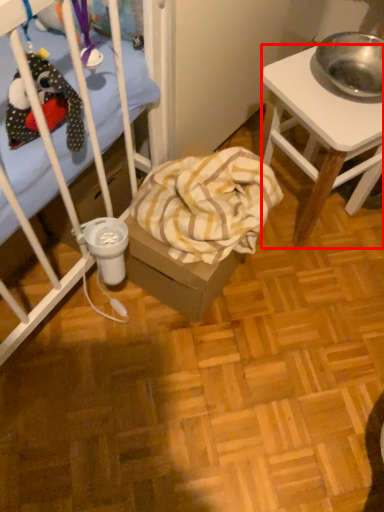
Question: From the image's perspective, where is desk (annotated by the red box) located in relation to blanket in the image?

Choices:
 (A) above
 (B) below

Answer: (A)